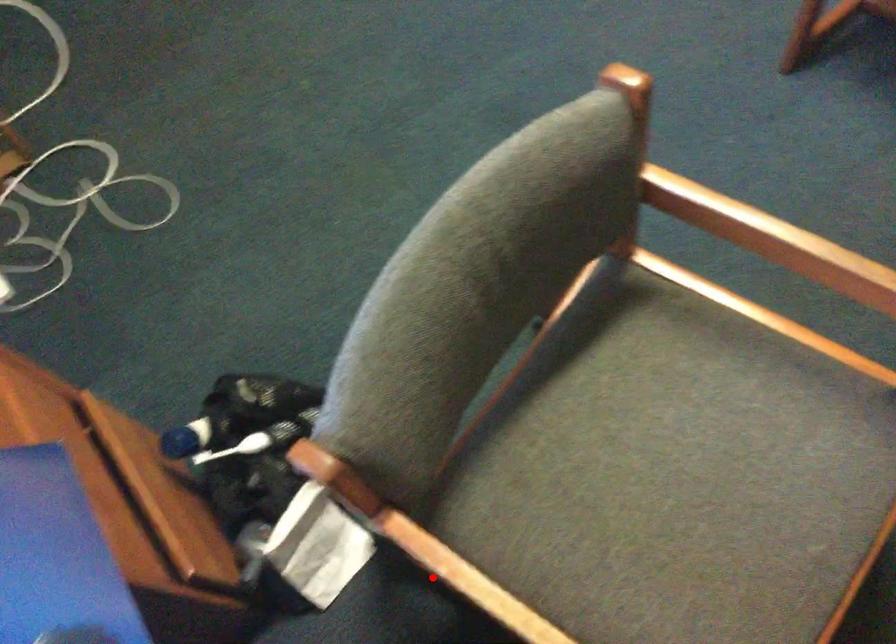
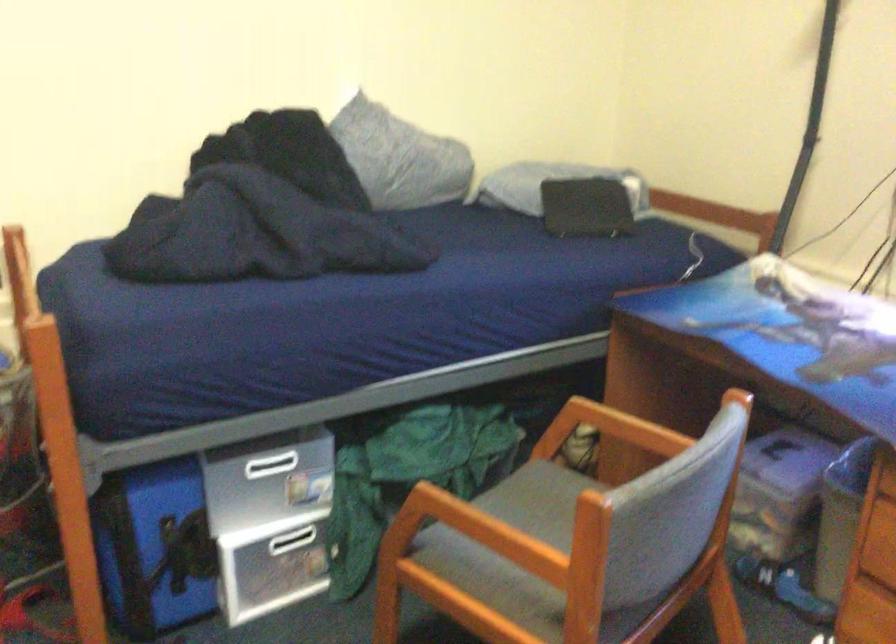
Question: I am providing you with two images of the same scene from different viewpoints. A red point is marked on the first image. At the location where the point appears in image 1, is it still visible in image 2?

Choices:
 (A) Yes
 (B) No

Answer: (B)